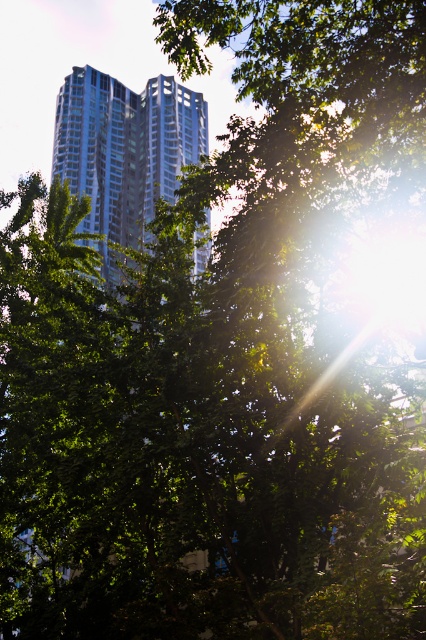
Question: Which object appears closest to the camera in this image?

Choices:
 (A) glassy silver skyscraper at center
 (B) glassy reflective building at center

Answer: (B)

Question: Which of the following is the farthest from the observer?

Choices:
 (A) glassy silver skyscraper at center
 (B) glassy reflective building at center

Answer: (A)

Question: Considering the relative positions of glassy reflective building at center and glassy silver skyscraper at center in the image provided, where is glassy reflective building at center located with respect to glassy silver skyscraper at center?

Choices:
 (A) below
 (B) above

Answer: (A)

Question: Is glassy reflective building at center further to the viewer compared to glassy silver skyscraper at center?

Choices:
 (A) yes
 (B) no

Answer: (B)

Question: Considering the relative positions of glassy reflective building at center and glassy silver skyscraper at center in the image provided, where is glassy reflective building at center located with respect to glassy silver skyscraper at center?

Choices:
 (A) left
 (B) right

Answer: (A)